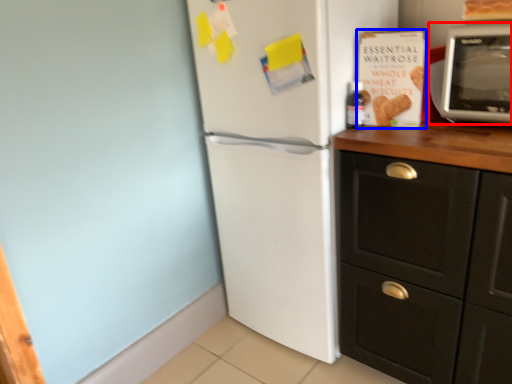
Question: Which of the following is the closest to the observer, microwave oven (highlighted by a red box) or magazine (highlighted by a blue box)?

Choices:
 (A) microwave oven
 (B) magazine

Answer: (A)